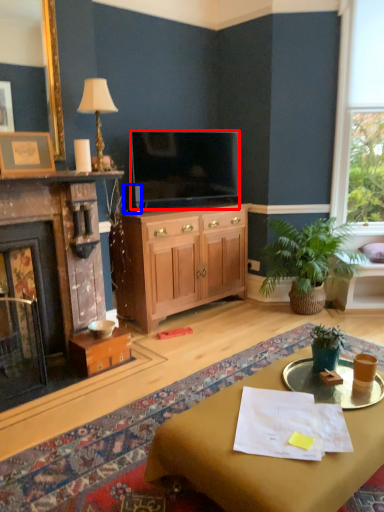
Question: Among these objects, which one is nearest to the camera, television (highlighted by a red box) or corded phone (highlighted by a blue box)?

Choices:
 (A) television
 (B) corded phone

Answer: (B)